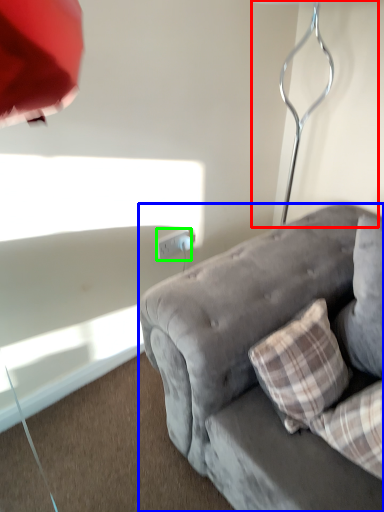
Question: Based on their relative distances, which object is nearer to table lamp (highlighted by a red box)? Choose from studio couch (highlighted by a blue box) and power outlet (highlighted by a green box).

Choices:
 (A) studio couch
 (B) power outlet

Answer: (A)